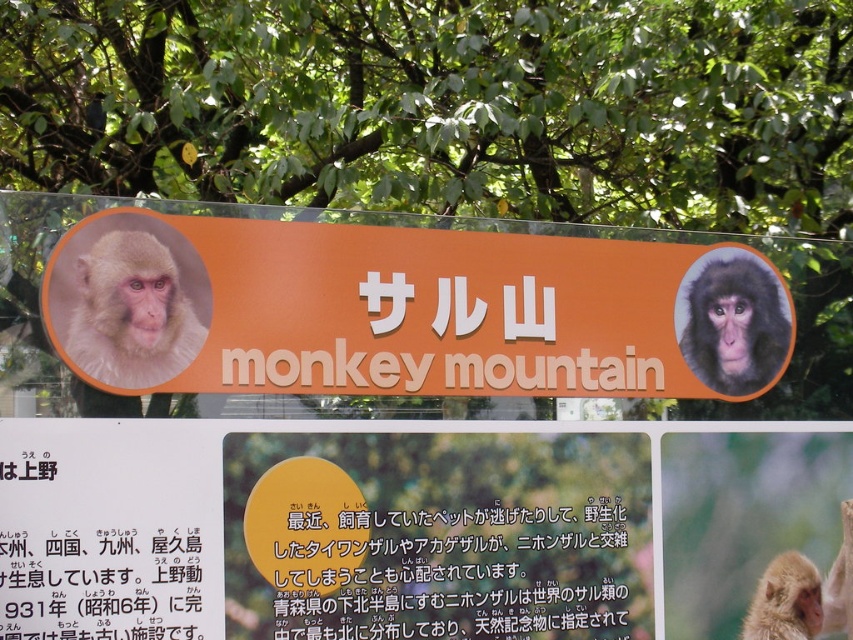
Can you confirm if orange matte signboard at center is positioned above black paper at lower left?

Correct, orange matte signboard at center is located above black paper at lower left.

Between orange matte signboard at center and black paper at lower left, which one has less height?

black paper at lower left is shorter.

Is point (715, 289) closer to viewer compared to point (134, 602)?

No, (715, 289) is further to viewer.

At what (x,y) coordinates should I click in order to perform the action: click on orange matte signboard at center. Please return your answer as a coordinate pair (x, y). Looking at the image, I should click on (407, 310).

Does dark brown fur monkey at upper right lie behind light brown fur monkey at center?

Yes, dark brown fur monkey at upper right is further from the viewer.

Who is positioned more to the right, dark brown fur monkey at upper right or light brown fur monkey at center?

Positioned to the right is light brown fur monkey at center.

Between point (755, 301) and point (838, 612), which one is positioned behind?

The point (755, 301) is more distant.

Locate an element on the screen. dark brown fur monkey at upper right is located at coordinates (735, 326).

Which is more to the left, light brown fur monkey at left or dark brown fur monkey at upper right?

light brown fur monkey at left is more to the left.

Locate an element on the screen. light brown fur monkey at left is located at coordinates pyautogui.click(x=131, y=312).

Who is more forward, (120, 272) or (770, 371)?

Point (120, 272) is more forward.

Identify the location of light brown fur monkey at left. This screenshot has height=640, width=853. (131, 312).